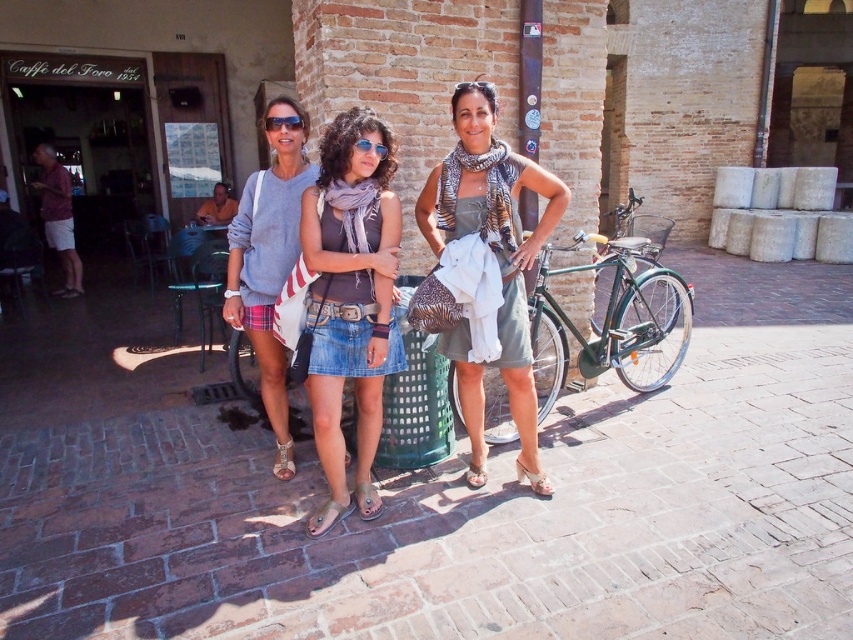
Question: Which point appears closest to the camera in this image?

Choices:
 (A) (70, 237)
 (B) (447, 193)

Answer: (B)

Question: Is green matte bicycle at right thinner than matte gray sweater at center?

Choices:
 (A) no
 (B) yes

Answer: (A)

Question: Which of the following is the farthest from the observer?

Choices:
 (A) (548, 259)
 (B) (250, 186)

Answer: (A)

Question: Which of the following is the closest to the observer?

Choices:
 (A) matte gray sweater at center
 (B) green dress at center
 (C) green matte bicycle at right

Answer: (B)

Question: Does green matte bicycle at right have a larger size compared to sunglasses at center?

Choices:
 (A) no
 (B) yes

Answer: (B)

Question: From the image, what is the correct spatial relationship of green matte bicycle at right in relation to sunglasses at center?

Choices:
 (A) below
 (B) above

Answer: (A)